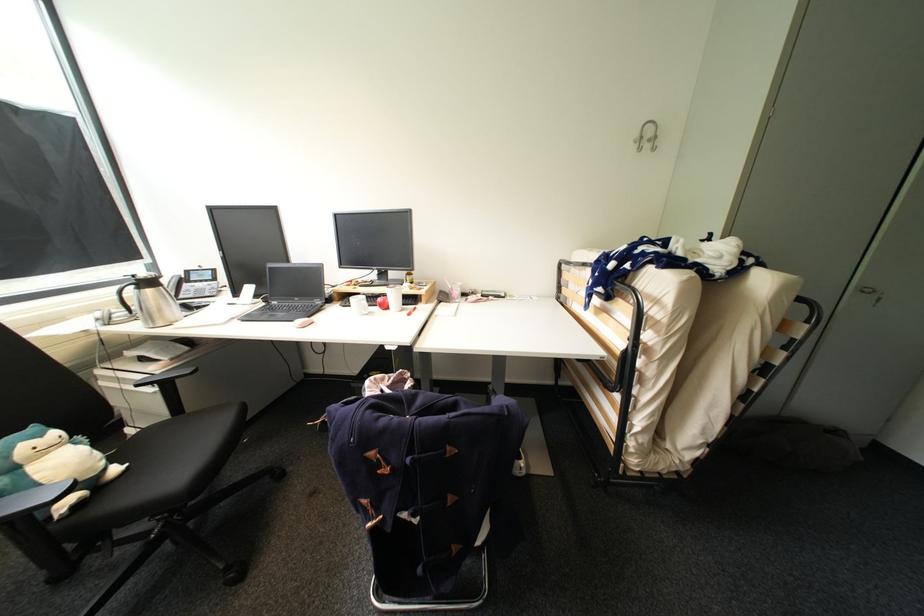
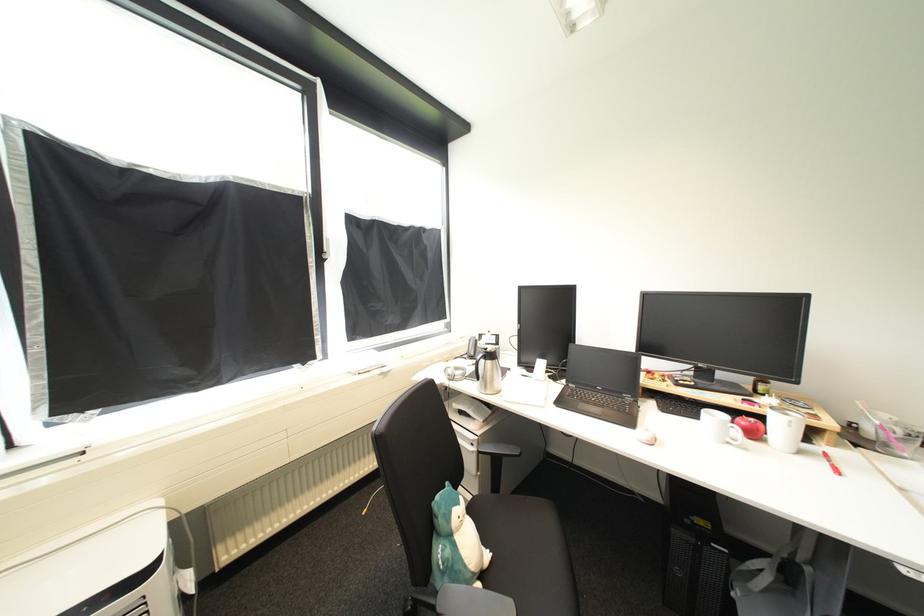
Find the pixel in the second image that matches [392,307] in the first image.

(761, 436)